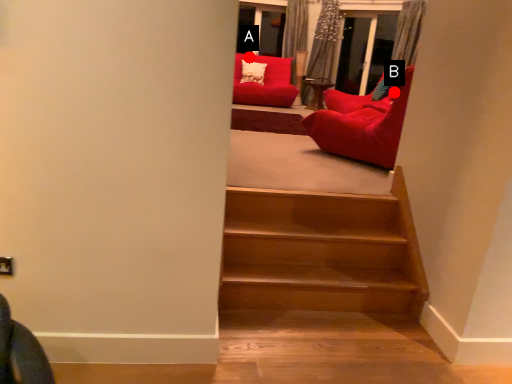
Question: Two points are circled on the image, labeled by A and B beside each circle. Which of the following is the farthest from the observer?

Choices:
 (A) A is further
 (B) B is further

Answer: (A)